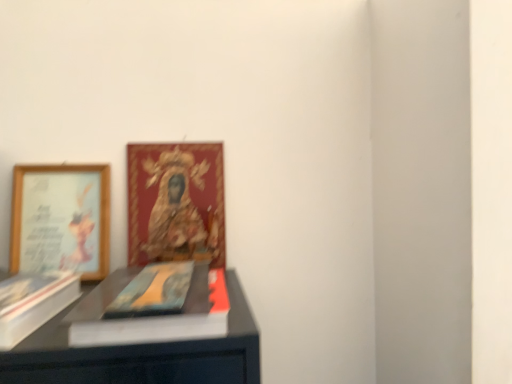
Question: Based on their positions, is wooden framed picture at left, the first picture frame viewed from the left, located to the left or right of matte blue book at center?

Choices:
 (A) right
 (B) left

Answer: (B)

Question: From the image's perspective, is wooden framed picture at left, the first picture frame viewed from the left, located above or below matte blue book at center?

Choices:
 (A) below
 (B) above

Answer: (B)

Question: Which object is the farthest from the matte blue book at center?

Choices:
 (A) wooden framed picture at left, the first picture frame viewed from the left
 (B) gold-framed picture at upper left, which appears as the first picture frame when viewed from the right
 (C) white matte paperback book at left

Answer: (A)

Question: Based on their relative distances, which object is farther from the gold-framed picture at upper left, which appears as the first picture frame when viewed from the right?

Choices:
 (A) matte blue book at center
 (B) white matte paperback book at left
 (C) wooden framed picture at left, which appears as the second picture frame when viewed from the right

Answer: (B)